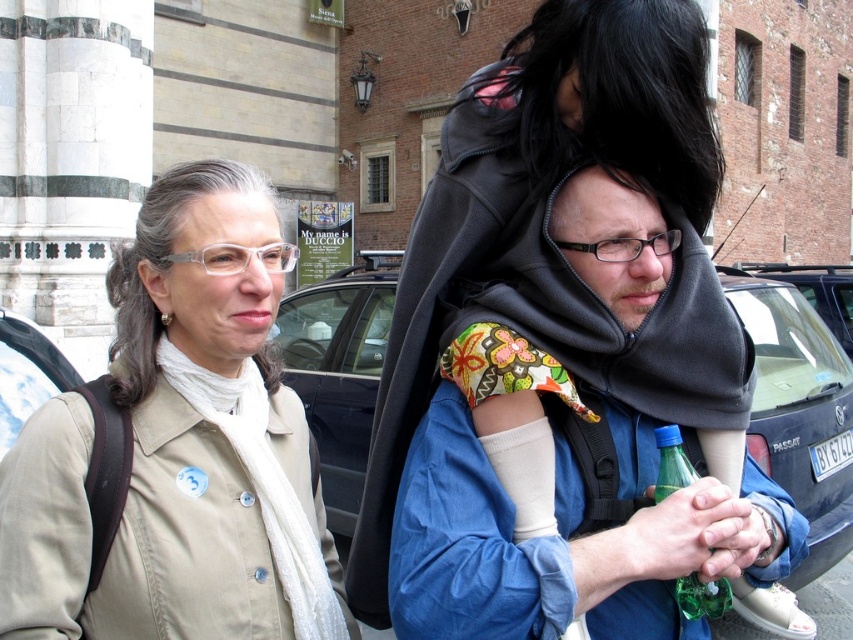
Question: Is blue cotton hoodie at center in front of blue matte car at center?

Choices:
 (A) yes
 (B) no

Answer: (A)

Question: Observing the image, what is the correct spatial positioning of beige fabric jacket at upper left in reference to green glass bottle at center?

Choices:
 (A) left
 (B) right

Answer: (A)

Question: Is blue cotton hoodie at center to the left of blue matte car at center from the viewer's perspective?

Choices:
 (A) no
 (B) yes

Answer: (A)

Question: Which object is the closest to the beige fabric jacket at upper left?

Choices:
 (A) green glass bottle at center
 (B) blue cotton hoodie at center

Answer: (B)

Question: Among these points, which one is nearest to the camera?

Choices:
 (A) (654, 493)
 (B) (13, 451)

Answer: (B)

Question: Among these points, which one is farthest from the camera?

Choices:
 (A) (761, 340)
 (B) (721, 579)
 (C) (235, 355)

Answer: (A)